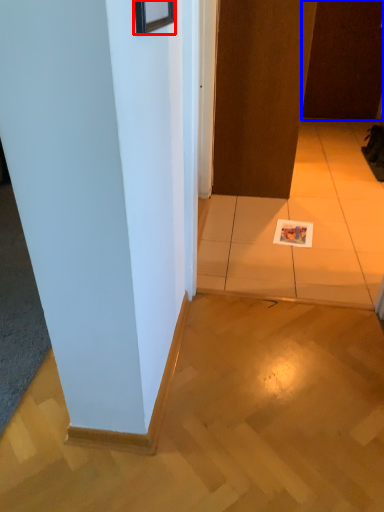
Question: Among these objects, which one is nearest to the camera, picture frame (highlighted by a red box) or door (highlighted by a blue box)?

Choices:
 (A) picture frame
 (B) door

Answer: (A)